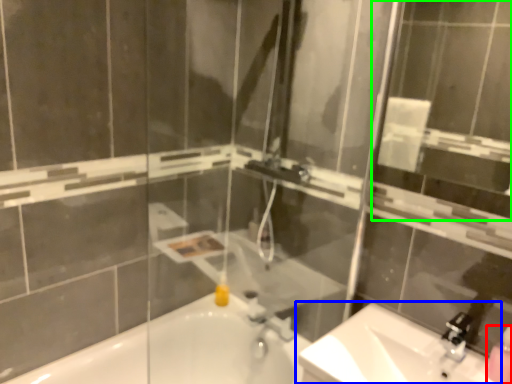
Question: Estimate the real-world distances between objects in this image. Which object is closer to soap dispenser (highlighted by a red box), sink (highlighted by a blue box) or mirror (highlighted by a green box)?

Choices:
 (A) sink
 (B) mirror

Answer: (A)